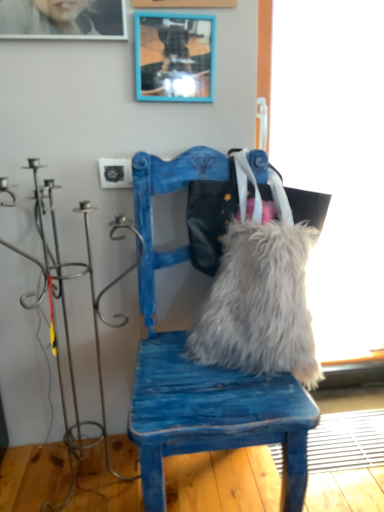
Measure the distance between point (135, 48) and camera.

The depth of point (135, 48) is 3.75 feet.

Find the location of `blue distressed wood chair at center`. blue distressed wood chair at center is located at coordinates (202, 366).

Locate an element on the screen. The height and width of the screenshot is (512, 384). white fluffy pillow at center is located at coordinates (260, 304).

Locate an element on the screen. The width and height of the screenshot is (384, 512). blue painted wood picture frame at upper center is located at coordinates coord(174,57).

How distant is fuzzy fabric messenger bag at center from blue painted wood picture frame at upper center?

They are 13.47 inches apart.

Find the location of `messenger bag that is on the right side of blue painted wood picture frame at upper center`. messenger bag that is on the right side of blue painted wood picture frame at upper center is located at coordinates (210, 218).

Is fuzzy fabric messenger bag at center oriented towards blue painted wood picture frame at upper center?

No.

From the image's perspective, is fuzzy fabric messenger bag at center positioned above or below blue painted wood picture frame at upper center?

fuzzy fabric messenger bag at center is situated lower than blue painted wood picture frame at upper center in the image.

Is white fluffy pillow at center taller than blue distressed wood chair at center?

No.

Is white fluffy pillow at center positioned far away from blue distressed wood chair at center?

They are positioned close to each other.

From a real-world perspective, is white fluffy pillow at center physically located above or below blue distressed wood chair at center?

white fluffy pillow at center is below blue distressed wood chair at center.

Looking at this image, in terms of width, does blue painted wood picture frame at upper center look wider or thinner when compared to fuzzy fabric messenger bag at center?

blue painted wood picture frame at upper center is thinner than fuzzy fabric messenger bag at center.

Considering the positions of points (161, 51) and (213, 249), is point (161, 51) farther from camera compared to point (213, 249)?

No, it is not.

Is blue painted wood picture frame at upper center taller than fuzzy fabric messenger bag at center?

Incorrect, the height of blue painted wood picture frame at upper center is not larger of that of fuzzy fabric messenger bag at center.

Where is `messenger bag on the right side of blue painted wood picture frame at upper center`? messenger bag on the right side of blue painted wood picture frame at upper center is located at coordinates (210, 218).

Is blue painted wood picture frame at upper center looking in the opposite direction of blue distressed wood chair at center?

No.

Is blue painted wood picture frame at upper center to the left of blue distressed wood chair at center from the viewer's perspective?

Indeed, blue painted wood picture frame at upper center is positioned on the left side of blue distressed wood chair at center.

Can we say blue painted wood picture frame at upper center lies outside blue distressed wood chair at center?

blue painted wood picture frame at upper center lies outside blue distressed wood chair at center's area.

Which point is more distant from viewer, (182, 73) or (244, 402)?

The point (182, 73) is farther from the camera.

Which is more distant, (295, 275) or (199, 258)?

Positioned behind is point (199, 258).

Is white fluffy pillow at center oriented away from fuzzy fabric messenger bag at center?

No.

Is white fluffy pillow at center wider than fuzzy fabric messenger bag at center?

Indeed, white fluffy pillow at center has a greater width compared to fuzzy fabric messenger bag at center.

Does point (225, 230) come farther from viewer compared to point (154, 492)?

Yes, point (225, 230) is behind point (154, 492).

Is fuzzy fabric messenger bag at center thinner than blue distressed wood chair at center?

Yes.

Is fuzzy fabric messenger bag at center bigger than blue distressed wood chair at center?

No, fuzzy fabric messenger bag at center is not bigger than blue distressed wood chair at center.

Would you say blue painted wood picture frame at upper center is a long distance from white fluffy pillow at center?

They are positioned close to each other.

Image resolution: width=384 pixels, height=512 pixels. Find the location of `pillow to the right of blue painted wood picture frame at upper center`. pillow to the right of blue painted wood picture frame at upper center is located at coordinates (260, 304).

Is point (144, 99) positioned after point (258, 300)?

Yes, it is.

Is blue painted wood picture frame at upper center to the left of white fluffy pillow at center from the viewer's perspective?

Indeed, blue painted wood picture frame at upper center is positioned on the left side of white fluffy pillow at center.

Locate an element on the screen. This screenshot has width=384, height=512. picture frame to the left of fuzzy fabric messenger bag at center is located at coordinates (174, 57).

Image resolution: width=384 pixels, height=512 pixels. I want to click on pillow behind the blue distressed wood chair at center, so click(260, 304).

Based on their spatial positions, is white fluffy pillow at center or fuzzy fabric messenger bag at center closer to blue painted wood picture frame at upper center?

fuzzy fabric messenger bag at center.

Considering their positions, is blue painted wood picture frame at upper center positioned closer to white fluffy pillow at center than blue distressed wood chair at center?

Based on the image, blue distressed wood chair at center appears to be nearer to white fluffy pillow at center.

Looking at the image, which one is located further to fuzzy fabric messenger bag at center, white fluffy pillow at center or blue painted wood picture frame at upper center?

blue painted wood picture frame at upper center lies further to fuzzy fabric messenger bag at center than the other object.

Looking at the image, which one is located closer to white fluffy pillow at center, blue distressed wood chair at center or blue painted wood picture frame at upper center?

blue distressed wood chair at center lies closer to white fluffy pillow at center than the other object.

Consider the image. Based on their spatial positions, is blue distressed wood chair at center or fuzzy fabric messenger bag at center closer to white fluffy pillow at center?

Based on the image, fuzzy fabric messenger bag at center appears to be nearer to white fluffy pillow at center.

From the image, which object appears to be nearer to fuzzy fabric messenger bag at center, blue painted wood picture frame at upper center or white fluffy pillow at center?

white fluffy pillow at center is positioned closer to the anchor fuzzy fabric messenger bag at center.

Which object lies nearer to the anchor point blue distressed wood chair at center, fuzzy fabric messenger bag at center or white fluffy pillow at center?

Based on the image, white fluffy pillow at center appears to be nearer to blue distressed wood chair at center.

Considering their positions, is fuzzy fabric messenger bag at center positioned further to blue painted wood picture frame at upper center than blue distressed wood chair at center?

blue distressed wood chair at center is positioned further to the anchor blue painted wood picture frame at upper center.

Image resolution: width=384 pixels, height=512 pixels. Identify the location of messenger bag between blue painted wood picture frame at upper center and blue distressed wood chair at center from top to bottom. (210, 218).

At what (x,y) coordinates should I click in order to perform the action: click on chair between blue painted wood picture frame at upper center and white fluffy pillow at center in the up-down direction. Please return your answer as a coordinate pair (x, y). Looking at the image, I should click on (202, 366).

Identify the location of pillow positioned between blue distressed wood chair at center and fuzzy fabric messenger bag at center from near to far. [260, 304].

Locate an element on the screen. The image size is (384, 512). messenger bag between blue painted wood picture frame at upper center and white fluffy pillow at center vertically is located at coordinates (210, 218).